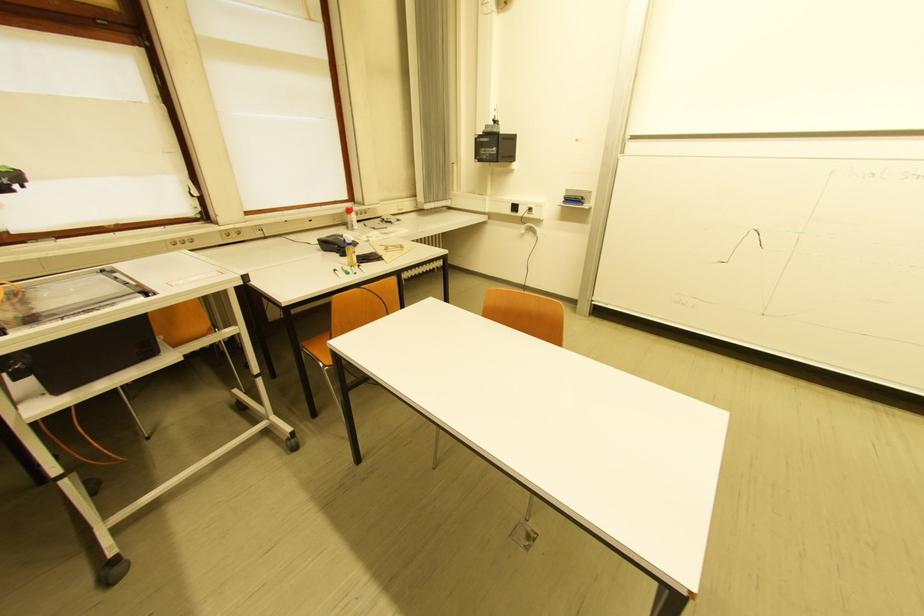
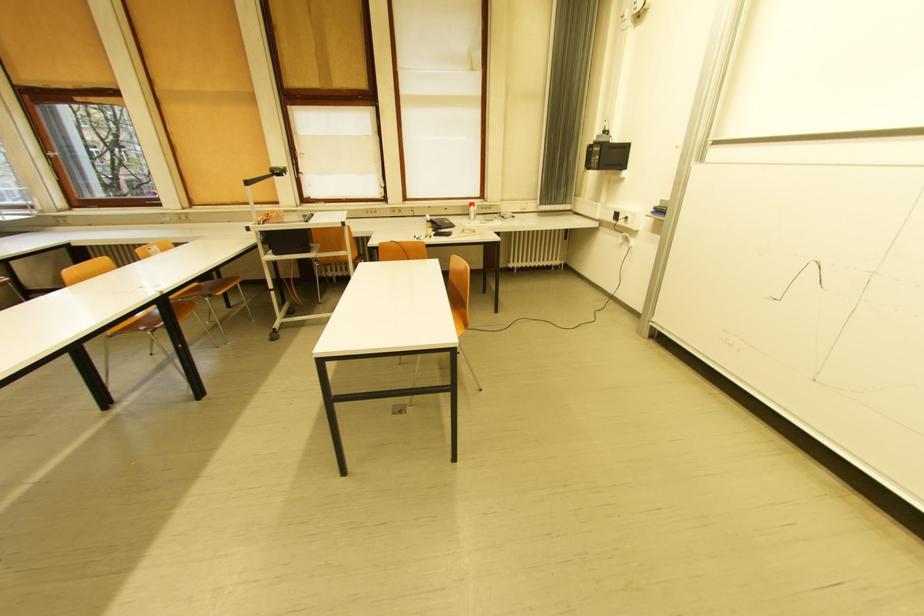
In the second image, find the point that corresponds to [339,217] in the first image.

(469, 208)